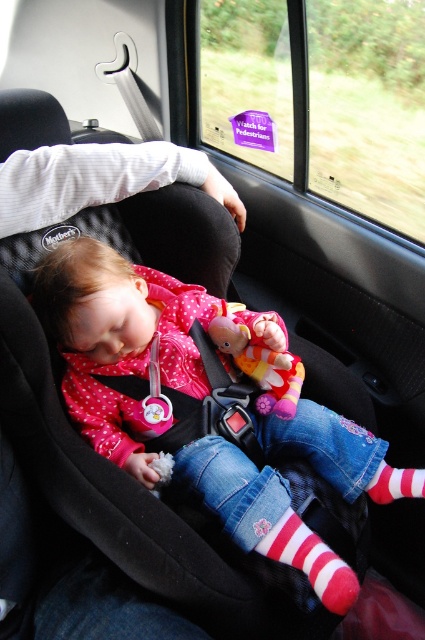
Question: Is white fabric at upper left thinner than fluffy fabric doll at center?

Choices:
 (A) no
 (B) yes

Answer: (A)

Question: Considering the real-world distances, which object is farthest from the white fabric at upper left?

Choices:
 (A) striped cotton sock at lower center
 (B) striped cotton sock at lower right
 (C) fluffy fabric doll at center

Answer: (B)

Question: From the image, what is the correct spatial relationship of white fabric at upper left in relation to striped cotton sock at lower right?

Choices:
 (A) left
 (B) right

Answer: (A)

Question: Among these objects, which one is nearest to the camera?

Choices:
 (A) striped cotton sock at lower center
 (B) fluffy fabric doll at center

Answer: (A)

Question: Which point is farther to the camera?

Choices:
 (A) white fabric at upper left
 (B) striped cotton sock at lower center
 (C) fluffy fabric doll at center
 (D) striped cotton sock at lower right

Answer: (C)

Question: Does white fabric at upper left appear on the left side of fluffy fabric doll at center?

Choices:
 (A) yes
 (B) no

Answer: (A)